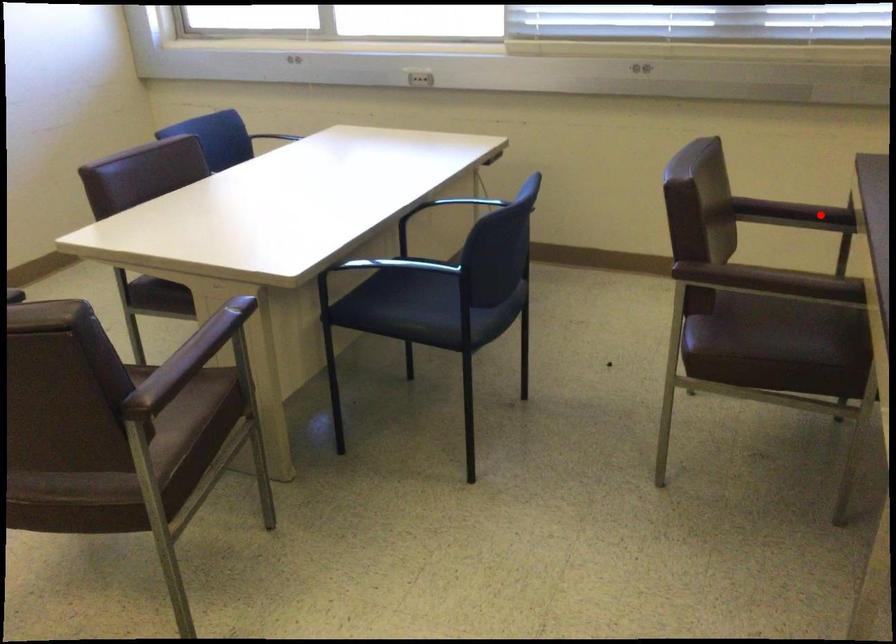
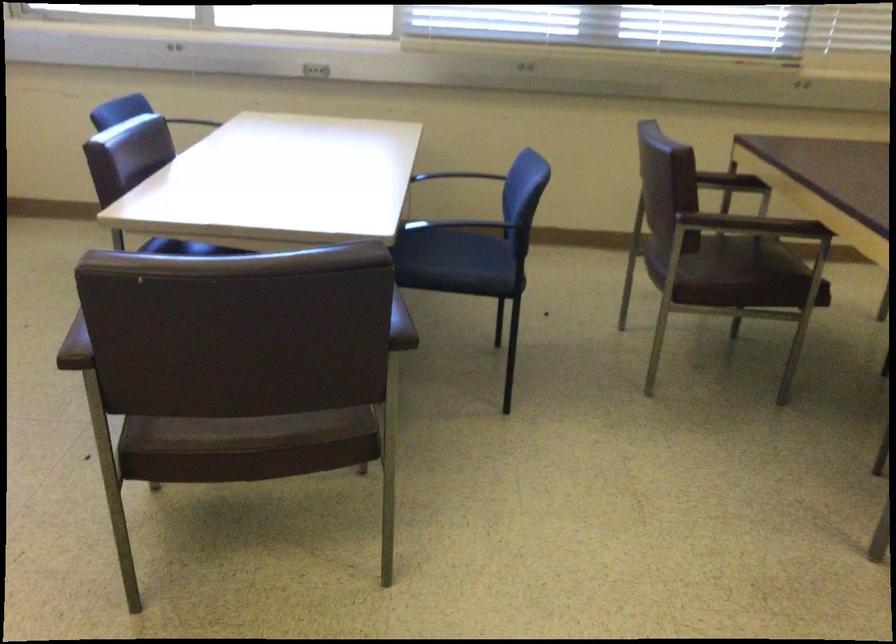
Question: I am providing you with two images of the same scene from different viewpoints. Image1 has a red point marked. In image2, the corresponding 3D location appears at what relative position? Reply with the corresponding letter.

Choices:
 (A) Closer
 (B) Farther

Answer: (B)